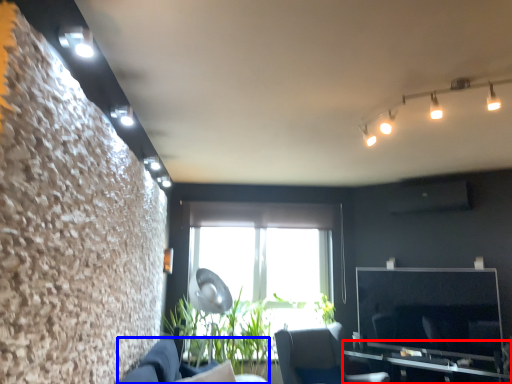
Question: Which object is closer to the camera taking this photo, table (highlighted by a red box) or couch (highlighted by a blue box)?

Choices:
 (A) table
 (B) couch

Answer: (B)